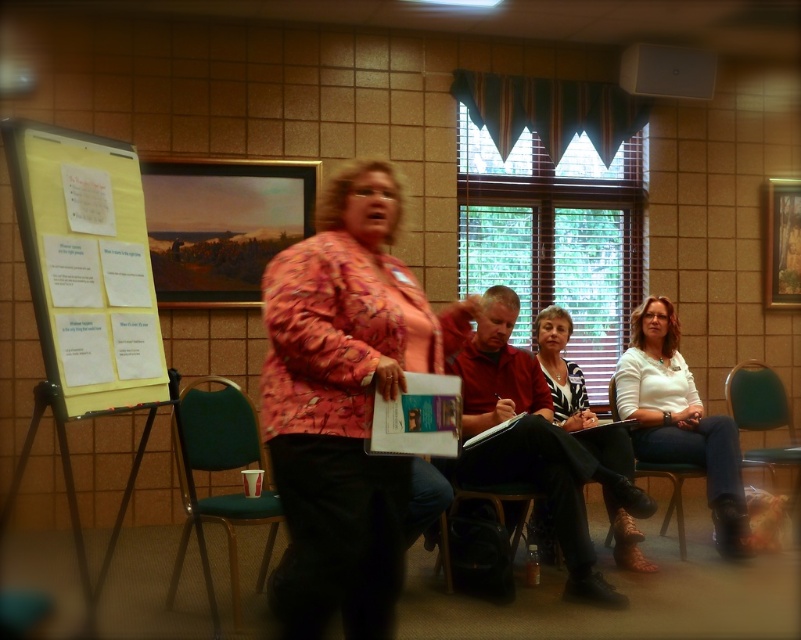
Question: Is white printed shirt at center bigger than green plastic chair at lower right?

Choices:
 (A) yes
 (B) no

Answer: (B)

Question: Considering the real-world distances, which object is closest to the green plastic chair at lower right?

Choices:
 (A) white printed shirt at center
 (B) matte red shirt at center

Answer: (A)

Question: Which object is positioned farthest from the white matte shirt at center?

Choices:
 (A) matte red shirt at center
 (B) white printed shirt at center

Answer: (A)

Question: In this image, where is green fabric chair at lower left located relative to white printed shirt at center?

Choices:
 (A) right
 (B) left

Answer: (B)

Question: Does white printed shirt at center appear over green plastic chair at lower right?

Choices:
 (A) yes
 (B) no

Answer: (A)

Question: Which point is farther to the camera?

Choices:
 (A) (679, 492)
 (B) (779, 380)

Answer: (A)